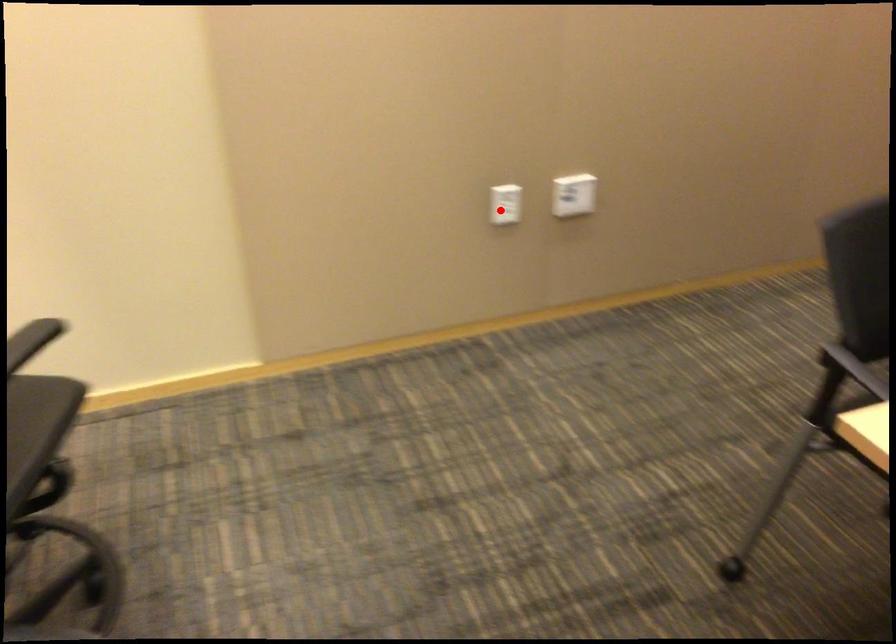
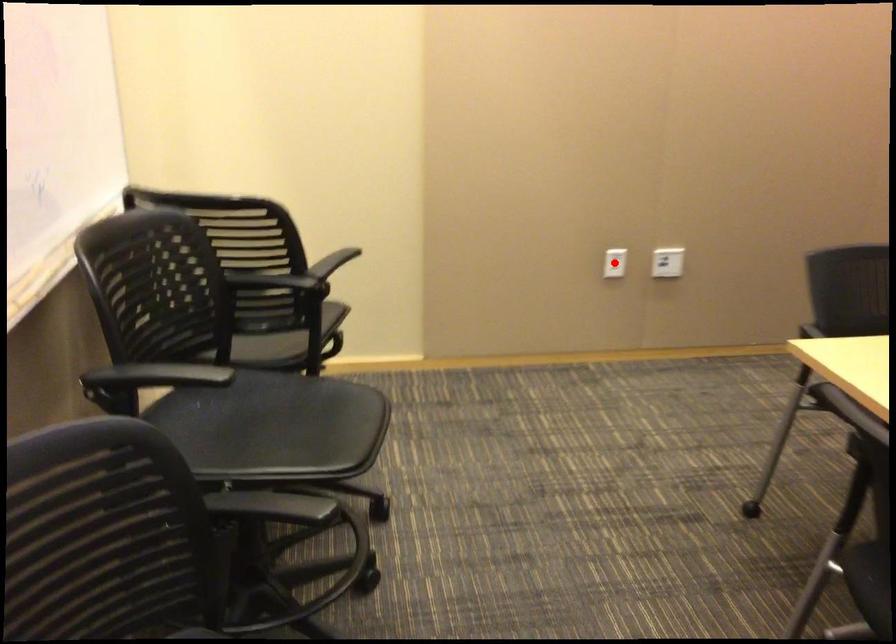
I am providing you with two images of the same scene from different viewpoints. A red point is marked on the first image and another point is marked on the second image. Are the points marked in image1 and image2 representing the same 3D position?

Yes